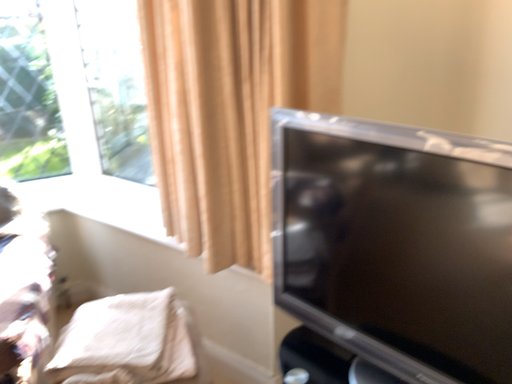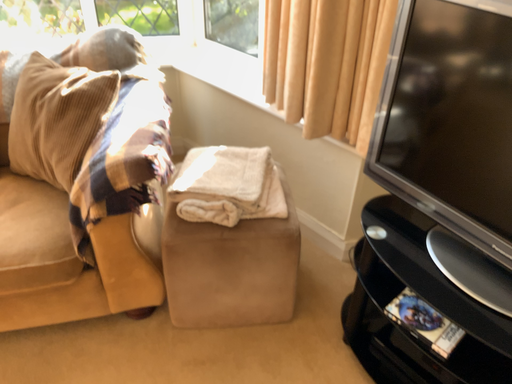
Question: How did the camera likely rotate when shooting the video?

Choices:
 (A) rotated upward
 (B) rotated downward

Answer: (B)